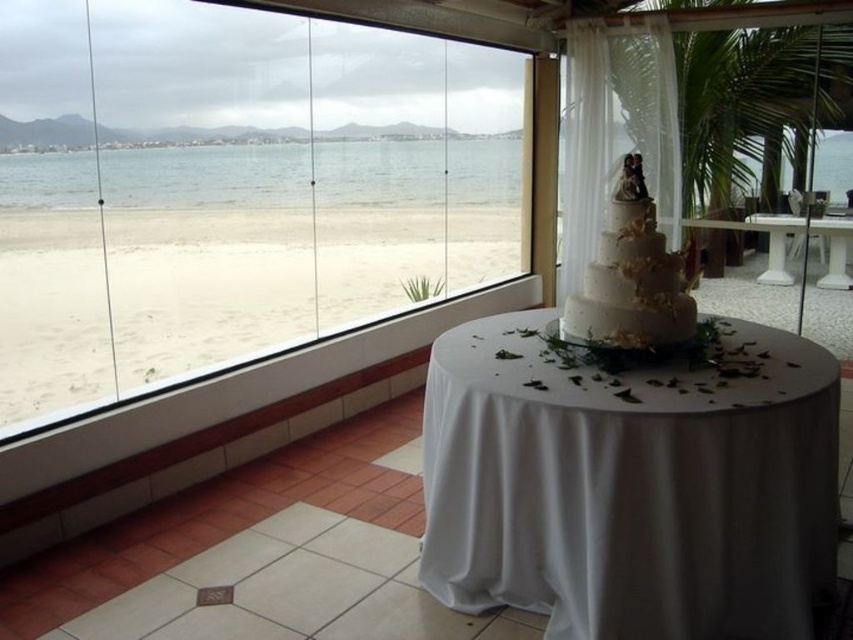
Does point (158, 182) come closer to viewer compared to point (798, 228)?

Yes, it is in front of point (798, 228).

The image size is (853, 640). In order to click on clear water at center in this screenshot , I will do `click(265, 173)`.

In the scene shown: Can you confirm if white cloth-covered table at center is positioned to the right of clear water at center?

Correct, you'll find white cloth-covered table at center to the right of clear water at center.

Is white cloth-covered table at center bigger than clear water at center?

Incorrect, white cloth-covered table at center is not larger than clear water at center.

Which is in front, point (560, 621) or point (221, 204)?

Point (560, 621)

Image resolution: width=853 pixels, height=640 pixels. Identify the location of white cloth-covered table at center. (631, 484).

Can you confirm if white textured cake at center is wider than white glossy table at center?

No.

Between white textured cake at center and white glossy table at center, which one is positioned lower?

Positioned lower is white textured cake at center.

Between point (650, 198) and point (840, 282), which one is positioned behind?

The point (840, 282) is more distant.

Find the location of a particular element. The height and width of the screenshot is (640, 853). white textured cake at center is located at coordinates (633, 276).